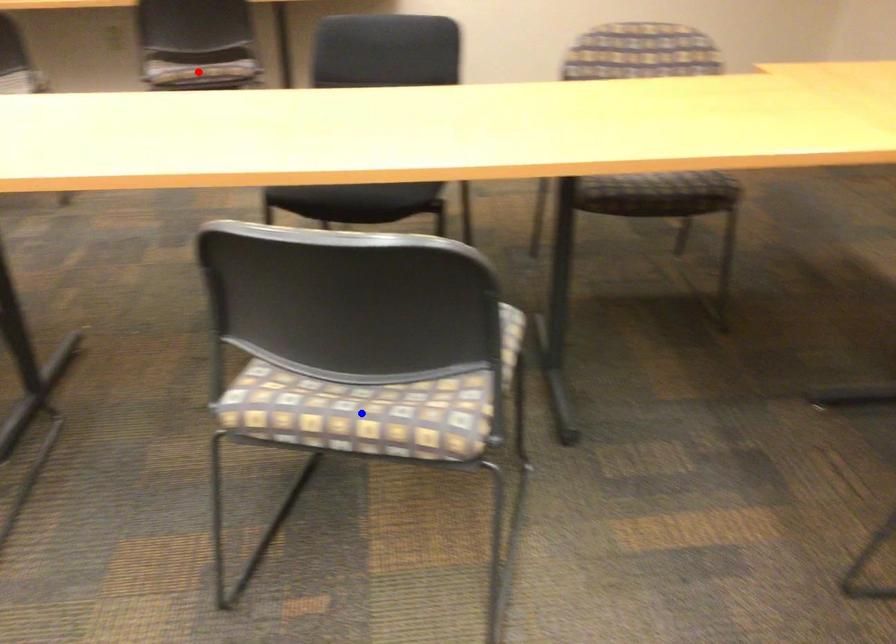
Question: Which of the two points in the image is closer to the camera?

Choices:
 (A) Blue point is closer.
 (B) Red point is closer.

Answer: (A)